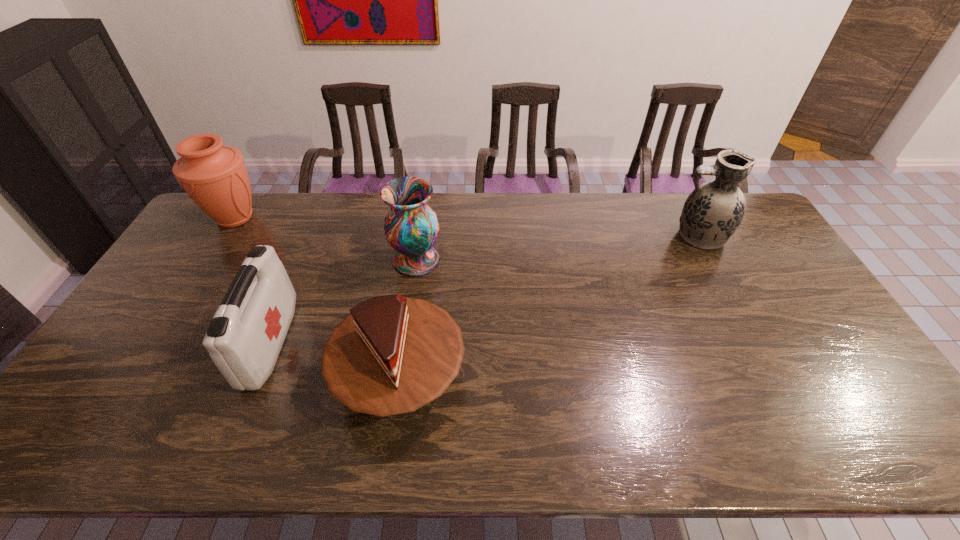
You are a GUI agent. You are given a task and a screenshot of the screen. Output one action in this format:
    pyautogui.click(x=<x>, y=<y>)
    Task: Click on the rightmost object
    
    Given the screenshot: What is the action you would take?
    pyautogui.click(x=713, y=211)

Locate an element on the screen. the leftmost object is located at coordinates (214, 176).

Locate an element on the screen. The height and width of the screenshot is (540, 960). the second vase from left to right is located at coordinates (411, 227).

At what (x,y) coordinates should I click in order to perform the action: click on the fourth object from right to left. Please return your answer as a coordinate pair (x, y). Image resolution: width=960 pixels, height=540 pixels. Looking at the image, I should click on click(244, 339).

Where is `cake`? The width and height of the screenshot is (960, 540). cake is located at coordinates (393, 354).

Identify the location of vacant space situated with the handle on the side of the rightmost vase. The width and height of the screenshot is (960, 540). pos(617,237).

Find the location of a particular element. The width and height of the screenshot is (960, 540). vacant position located 0.400m with the handle on the side of the rightmost vase is located at coordinates (554, 237).

The height and width of the screenshot is (540, 960). What are the coordinates of `vacant area located with the handle on the side of the rightmost vase` in the screenshot? It's located at (597, 237).

Identify the location of free location located 0.340m on the front of the leftmost vase. This screenshot has height=540, width=960. click(x=176, y=314).

The height and width of the screenshot is (540, 960). I want to click on vacant space located 0.250m on the front of the second vase from left to right, so (x=404, y=345).